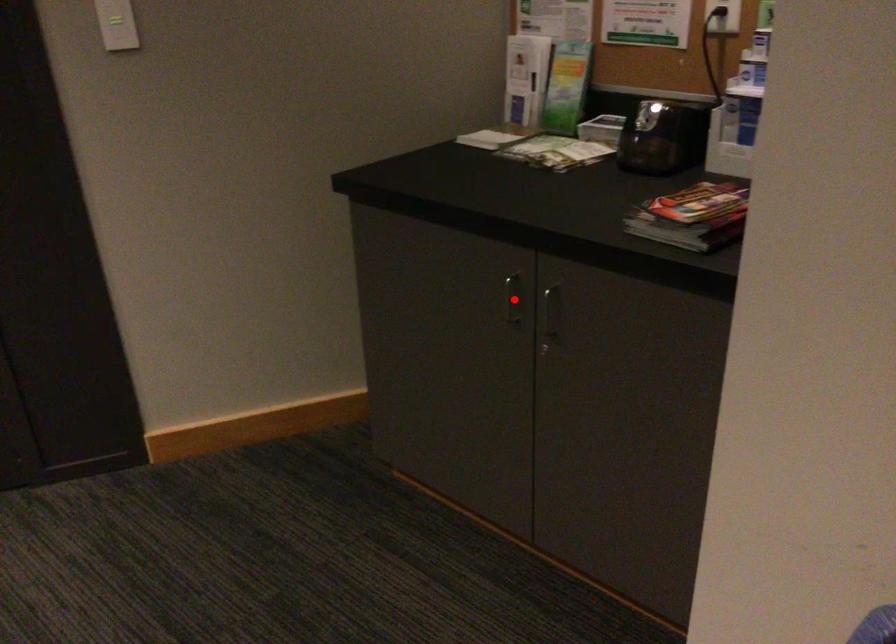
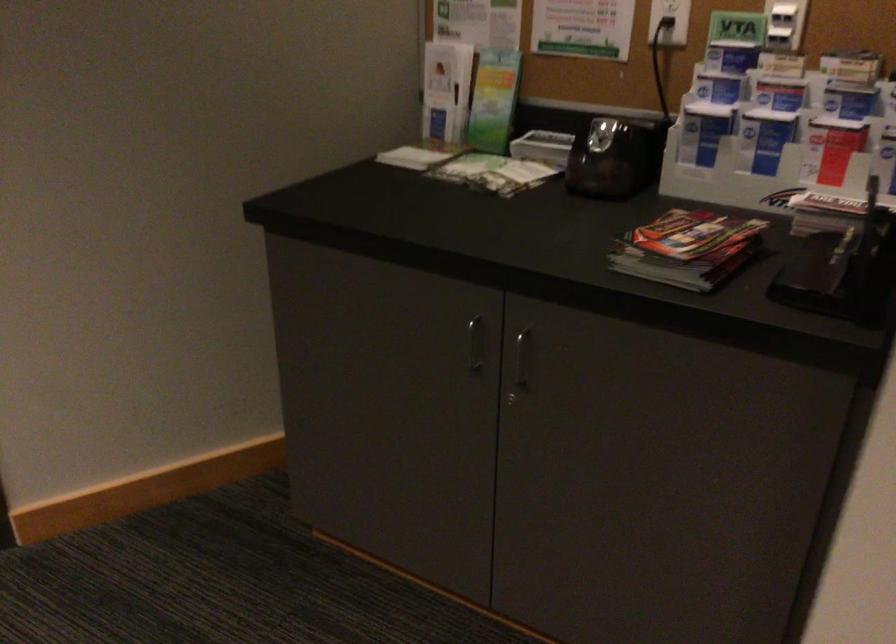
Question: I am providing you with two images of the same scene from different viewpoints. Given a red point in image1, look at the same physical point in image2. Is it:

Choices:
 (A) Closer to the viewpoint
 (B) Farther from the viewpoint

Answer: (A)